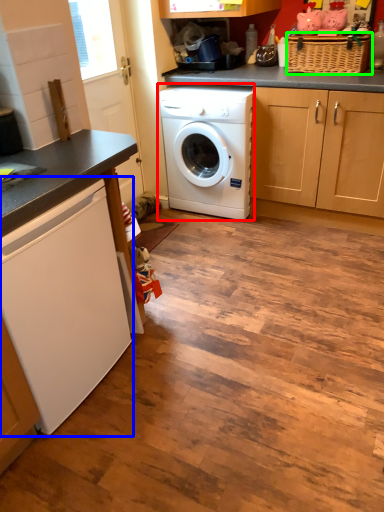
Question: Based on their relative distances, which object is farther from washing machine (highlighted by a red box)? Choose from washing machine (highlighted by a blue box) and basket (highlighted by a green box).

Choices:
 (A) washing machine
 (B) basket

Answer: (A)